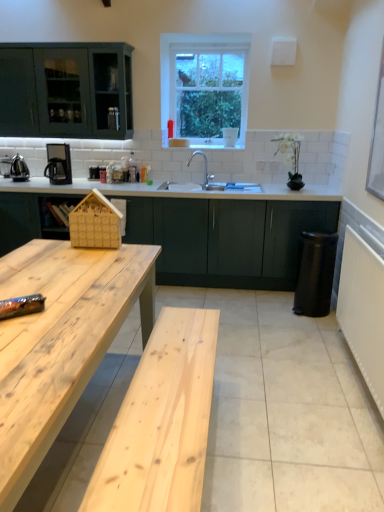
Question: Can you confirm if natural wood table at lower left is bigger than white textured radiator at right?

Choices:
 (A) yes
 (B) no

Answer: (A)

Question: Is the depth of natural wood table at lower left less than that of white textured radiator at right?

Choices:
 (A) yes
 (B) no

Answer: (A)

Question: Is natural wood table at lower left far from white textured radiator at right?

Choices:
 (A) no
 (B) yes

Answer: (B)

Question: Is natural wood table at lower left directly adjacent to white textured radiator at right?

Choices:
 (A) no
 (B) yes

Answer: (A)

Question: Is natural wood table at lower left shorter than white textured radiator at right?

Choices:
 (A) no
 (B) yes

Answer: (A)

Question: Is natural wood table at lower left not within white textured radiator at right?

Choices:
 (A) no
 (B) yes

Answer: (B)

Question: Is wooden house at center facing towards white textured radiator at right?

Choices:
 (A) yes
 (B) no

Answer: (B)

Question: Is wooden house at center next to white textured radiator at right?

Choices:
 (A) no
 (B) yes

Answer: (A)

Question: From the image's perspective, would you say wooden house at center is positioned over white textured radiator at right?

Choices:
 (A) yes
 (B) no

Answer: (A)

Question: Can you confirm if wooden house at center is smaller than white textured radiator at right?

Choices:
 (A) no
 (B) yes

Answer: (B)

Question: Is wooden house at center thinner than white textured radiator at right?

Choices:
 (A) no
 (B) yes

Answer: (B)

Question: From a real-world perspective, is wooden house at center positioned under white textured radiator at right based on gravity?

Choices:
 (A) no
 (B) yes

Answer: (A)

Question: Is wooden house at center closer to the viewer compared to matte black coffee machine at left?

Choices:
 (A) yes
 (B) no

Answer: (A)